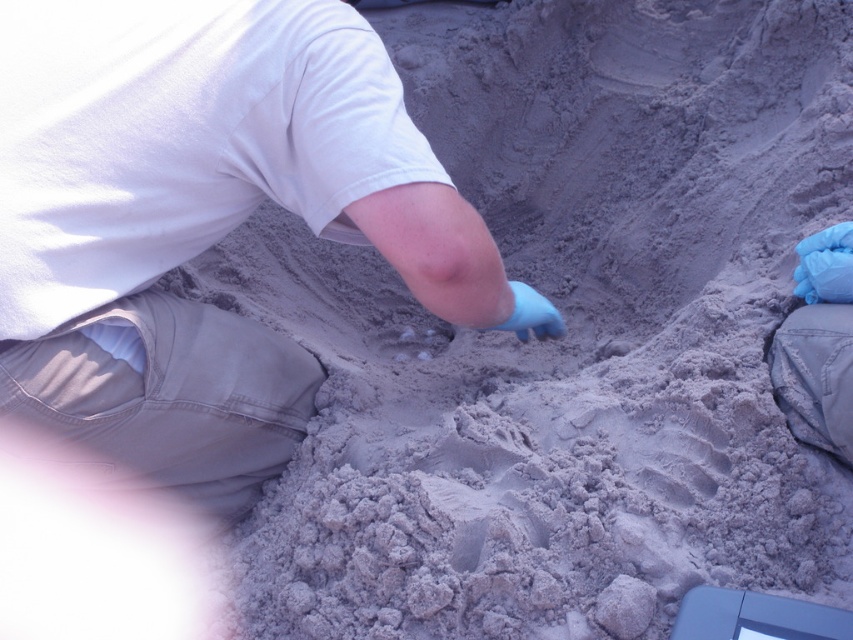
You are a researcher in the field and need to place a small device on the sand. The device requires a flat surface to function properly. According to the image, is the area at point [202,220] suitable for placing the device?

The area at point [202,220] has the white matte shirt at center lying on it, so it is not suitable for placing the device as the shirt would interfere with the device.